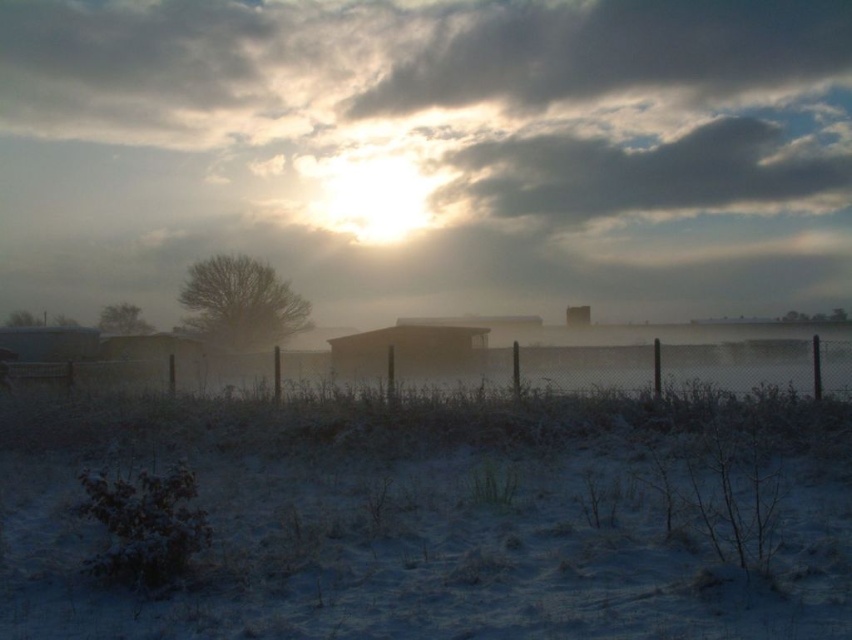
Measure the distance between point [239,193] and camera.

Point [239,193] and camera are 61.44 meters apart.

Does frosted glass morning fog at center lie behind dark gray cloud at upper center?

That is False.

This screenshot has width=852, height=640. Find the location of `frosted glass morning fog at center`. frosted glass morning fog at center is located at coordinates (429, 150).

Locate an element on the screen. Image resolution: width=852 pixels, height=640 pixels. frosted glass morning fog at center is located at coordinates (429, 150).

Between dark gray cloud at upper center and cloudy at upper center, which one is positioned higher?

dark gray cloud at upper center is above.

Does dark gray cloud at upper center lie in front of cloudy at upper center?

No, dark gray cloud at upper center is further to the viewer.

Is point (608, 74) positioned after point (452, 193)?

Yes, it is.

Identify the location of dark gray cloud at upper center. (612, 52).

Is the position of dark gray cloud at upper center more distant than that of brown matte hut at center?

Yes, it is behind brown matte hut at center.

Identify the location of dark gray cloud at upper center. The height and width of the screenshot is (640, 852). (612, 52).

Identify the location of dark gray cloud at upper center. The height and width of the screenshot is (640, 852). (612, 52).